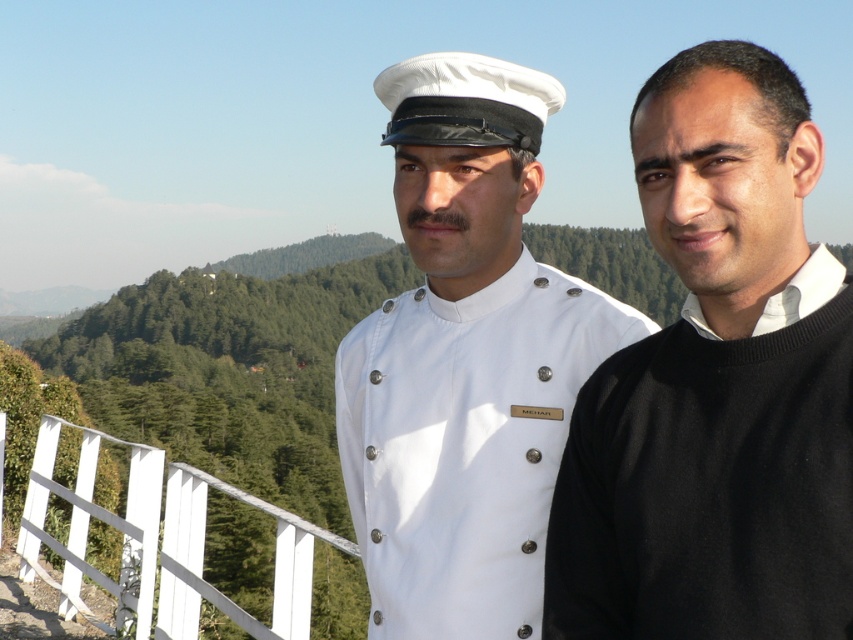
Consider the image. Does black wool sweater at right appear on the left side of white wooden fence at lower left?

In fact, black wool sweater at right is to the right of white wooden fence at lower left.

What do you see at coordinates (712, 477) in the screenshot?
I see `black wool sweater at right` at bounding box center [712, 477].

You are a GUI agent. You are given a task and a screenshot of the screen. Output one action in this format:
    pyautogui.click(x=<x>, y=<y>)
    Task: Click on the black wool sweater at right
    The image size is (853, 640).
    Given the screenshot: What is the action you would take?
    712,477

Can you confirm if white uniform at center is positioned below white matte uniform at center?

No.

Who is more distant from viewer, (648, 147) or (468, 374)?

The point (468, 374) is behind.

The height and width of the screenshot is (640, 853). What do you see at coordinates (717, 387) in the screenshot?
I see `white uniform at center` at bounding box center [717, 387].

You are a GUI agent. You are given a task and a screenshot of the screen. Output one action in this format:
    pyautogui.click(x=<x>, y=<y>)
    Task: Click on the white uniform at center
    
    Given the screenshot: What is the action you would take?
    pyautogui.click(x=717, y=387)

Image resolution: width=853 pixels, height=640 pixels. I want to click on white uniform at center, so click(717, 387).

Can you confirm if white uniform at center is smaller than black wool sweater at right?

No.

Is point (672, 632) more distant than point (567, 524)?

No, it is not.

Image resolution: width=853 pixels, height=640 pixels. I want to click on white uniform at center, so click(x=717, y=387).